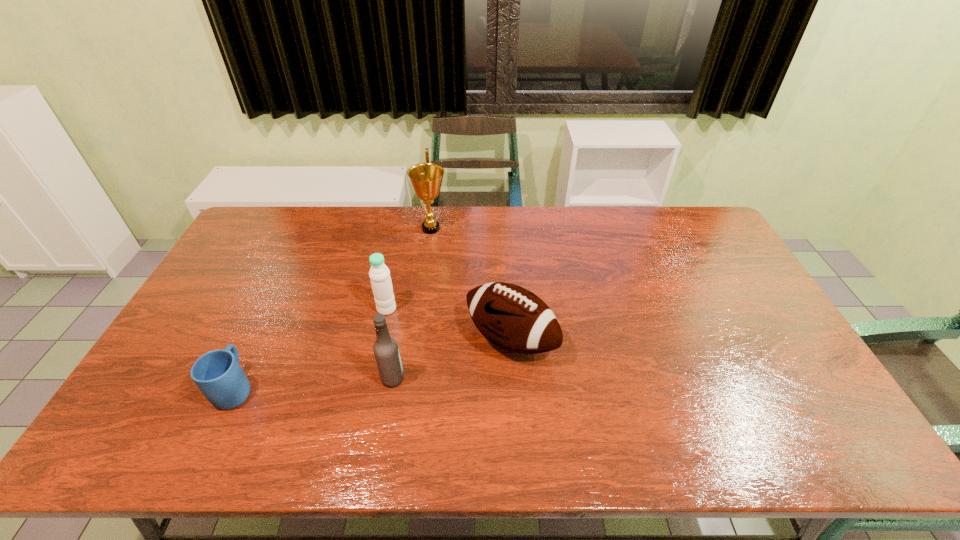
Locate an element on the screen. This screenshot has height=540, width=960. the tallest object is located at coordinates (426, 178).

You are a GUI agent. You are given a task and a screenshot of the screen. Output one action in this format:
    pyautogui.click(x=<x>, y=<y>)
    Task: Click on the farthest object
    
    Given the screenshot: What is the action you would take?
    pyautogui.click(x=426, y=178)

You are a GUI agent. You are given a task and a screenshot of the screen. Output one action in this format:
    pyautogui.click(x=<x>, y=<y>)
    Task: Click on the beer bottle
    The width and height of the screenshot is (960, 540).
    Given the screenshot: What is the action you would take?
    pyautogui.click(x=386, y=351)

Locate an element on the screen. This screenshot has height=540, width=960. water bottle is located at coordinates (379, 273).

Locate an element on the screen. the rightmost object is located at coordinates (513, 318).

Locate an element on the screen. the leftmost object is located at coordinates (218, 374).

The image size is (960, 540). I want to click on mug, so click(x=218, y=374).

Where is `vacant space located on the front view with handles of the tallest object`? The image size is (960, 540). vacant space located on the front view with handles of the tallest object is located at coordinates (502, 228).

Find the location of a particular element. vacant region located on the label of the beer bottle is located at coordinates (423, 379).

The width and height of the screenshot is (960, 540). What are the coordinates of `blank area located on the front of the water bottle` in the screenshot? It's located at (374, 366).